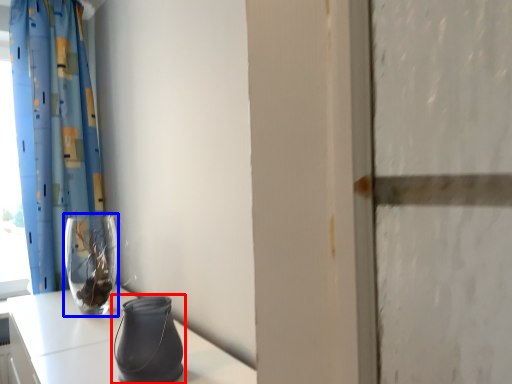
Question: Which object appears farthest to the camera in this image, vase (highlighted by a red box) or vase (highlighted by a blue box)?

Choices:
 (A) vase
 (B) vase

Answer: (B)